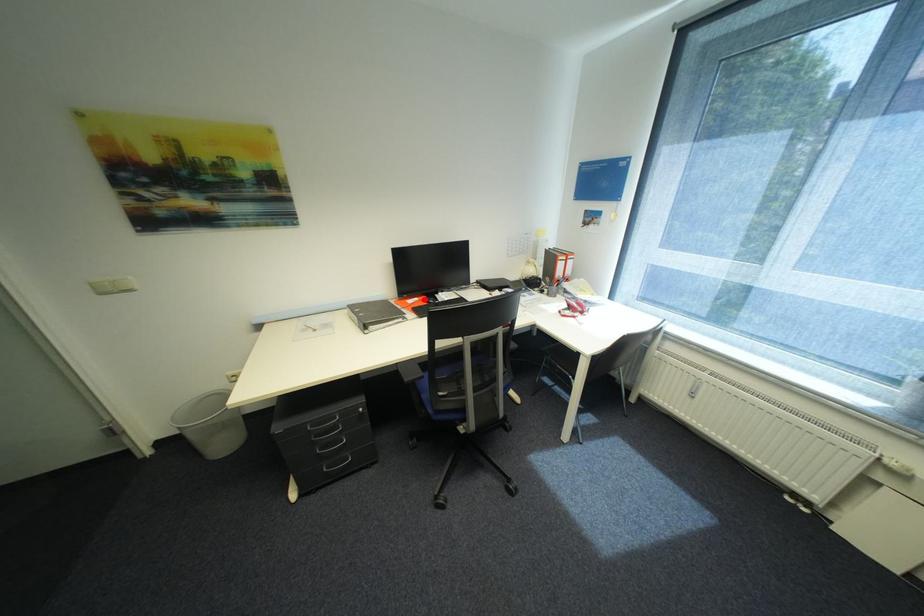
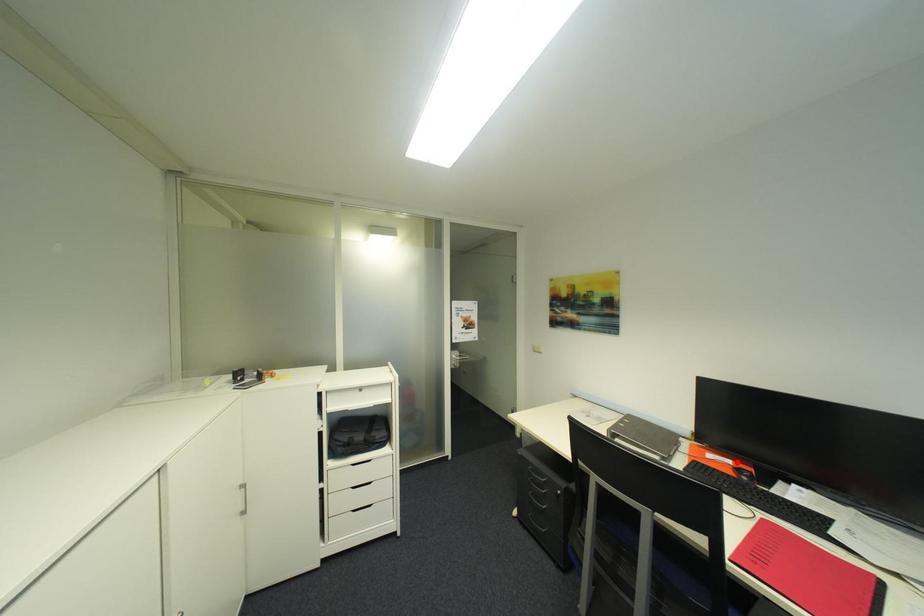
I am providing you with two images of the same scene from different viewpoints. A red point is marked on the first image and another point is marked on the second image. Are the points marked in image1 and image2 representing the same 3D position?

Yes